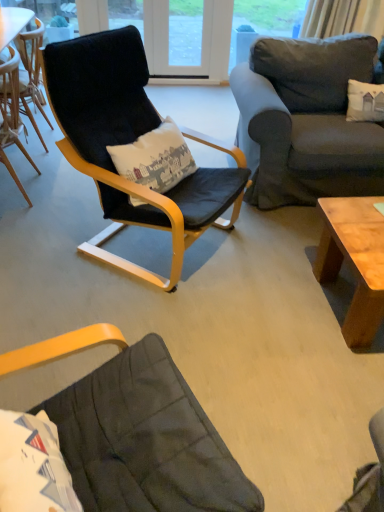
Question: Is velvet black armchair at center, the second chair in the left-to-right sequence, turned away from light brown wood coffee table at lower right?

Choices:
 (A) no
 (B) yes

Answer: (A)

Question: Is velvet black armchair at center, the second chair in the left-to-right sequence, aimed at light brown wood coffee table at lower right?

Choices:
 (A) yes
 (B) no

Answer: (A)

Question: Does velvet black armchair at center, placed as the first chair when sorted from right to left, appear on the left side of light brown wood coffee table at lower right?

Choices:
 (A) yes
 (B) no

Answer: (A)

Question: Can we say velvet black armchair at center, placed as the first chair when sorted from right to left, lies outside light brown wood coffee table at lower right?

Choices:
 (A) yes
 (B) no

Answer: (A)

Question: Does velvet black armchair at center, placed as the first chair when sorted from right to left, have a greater width compared to light brown wood coffee table at lower right?

Choices:
 (A) yes
 (B) no

Answer: (A)

Question: From a real-world perspective, is velvet black armchair at center, placed as the first chair when sorted from right to left, located higher than light brown wood coffee table at lower right?

Choices:
 (A) yes
 (B) no

Answer: (A)

Question: Is there a large distance between light brown wood coffee table at lower right and wooden chair at left, the second chair in the right-to-left sequence?

Choices:
 (A) yes
 (B) no

Answer: (A)

Question: From a real-world perspective, is light brown wood coffee table at lower right on wooden chair at left, the second chair in the right-to-left sequence?

Choices:
 (A) yes
 (B) no

Answer: (B)

Question: Considering the relative sizes of light brown wood coffee table at lower right and wooden chair at left, which is counted as the first chair, starting from the left, in the image provided, is light brown wood coffee table at lower right wider than wooden chair at left, which is counted as the first chair, starting from the left,?

Choices:
 (A) no
 (B) yes

Answer: (B)

Question: Does light brown wood coffee table at lower right have a lesser height compared to wooden chair at left, which is counted as the first chair, starting from the left?

Choices:
 (A) yes
 (B) no

Answer: (A)

Question: From the image's perspective, is light brown wood coffee table at lower right above wooden chair at left, which is counted as the first chair, starting from the left?

Choices:
 (A) yes
 (B) no

Answer: (B)

Question: Is light brown wood coffee table at lower right not within wooden chair at left, the second chair in the right-to-left sequence?

Choices:
 (A) yes
 (B) no

Answer: (A)

Question: Is wooden chair at left, which is counted as the first chair, starting from the left, bigger than dark gray fabric couch at upper right?

Choices:
 (A) yes
 (B) no

Answer: (B)